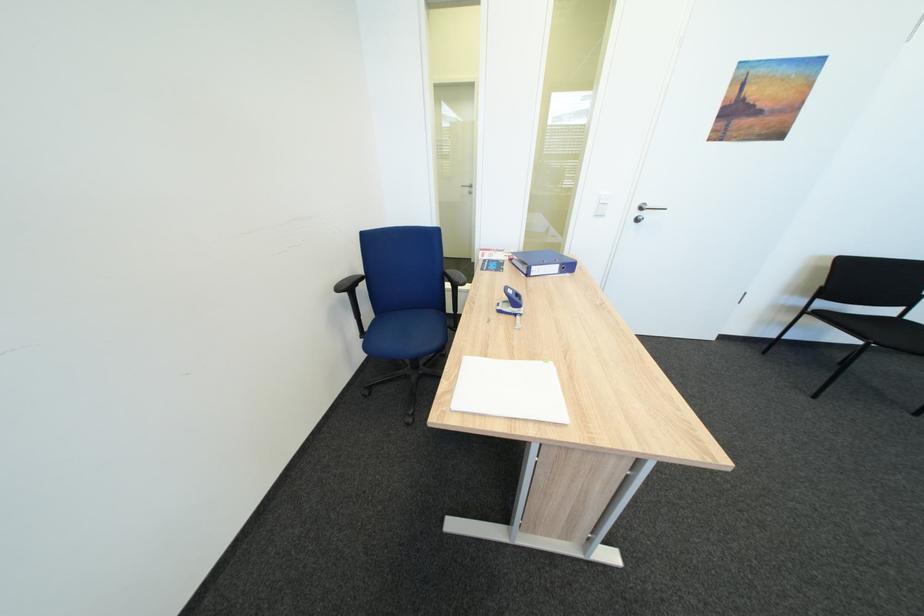
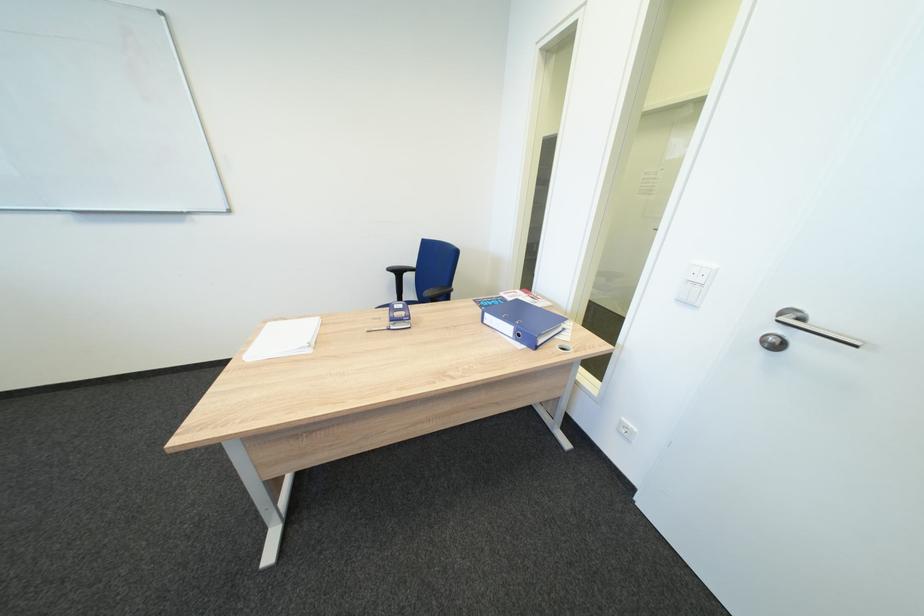
Where in the second image is the point corresponding to (x=521, y=294) from the first image?

(407, 309)